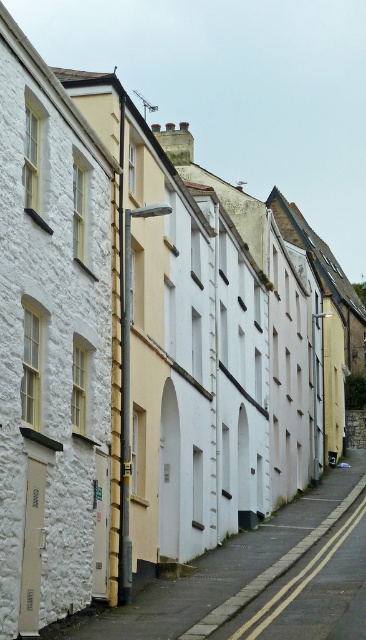
Based on the photo, you are a delivery person trying to park your van, which is 2 meters wide, on the smooth asphalt road at center. The white stone building at center is in the way. Can you park your van there without overlapping the building?

The white stone building at center occupies less space than the smooth asphalt road at center, so there is enough space to park the van as long as it doesn not overlap the building.

You are a delivery driver who needs to park your van on the smooth asphalt road at center. However, there is a white stone building at center blocking the view. Can you safely park your van there without obstructing the road?

The white stone building at center is in front of the smooth asphalt road at center, so parking your van there might block the road. Choose another location to park.

You are standing on the sidewalk of a narrow street lined with traditional terraced houses. You notice a point marked at coordinates [62,602]. Considering the double yellow line and the no parking zone, can you estimate how far this point is from your current position?

The point at [62,602] is 81.50 feet away from your current position.